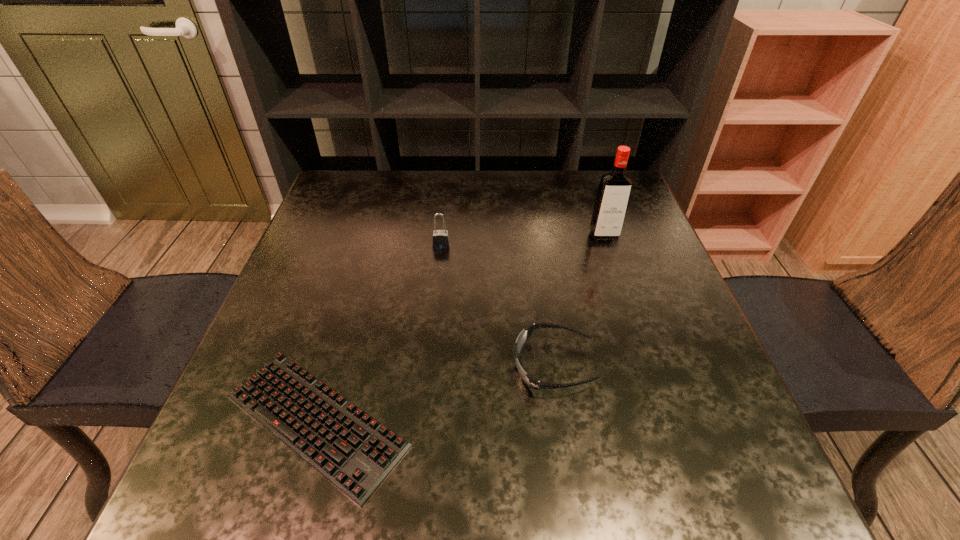
Locate an element on the screen. Image resolution: width=960 pixels, height=540 pixels. vacant area that lies between the vodka and the second shortest object is located at coordinates (579, 300).

Where is `vacant area that lies between the sunglasses and the computer keyboard`? The image size is (960, 540). vacant area that lies between the sunglasses and the computer keyboard is located at coordinates click(x=435, y=393).

This screenshot has width=960, height=540. Identify the location of object that is the third closest to the second object from right to left. (615, 186).

Locate an element on the screen. The width and height of the screenshot is (960, 540). object that is the closest to the padlock is located at coordinates (522, 339).

Identify the location of blank area in the image that satisfies the following two spatial constraints: 1. on the front and back of the farthest object; 2. on the lenses of the sunglasses. The height and width of the screenshot is (540, 960). (647, 365).

Identify the location of free space that satisfies the following two spatial constraints: 1. on the lenses of the second object from right to left; 2. on the front side of the computer keyboard. This screenshot has height=540, width=960. (562, 421).